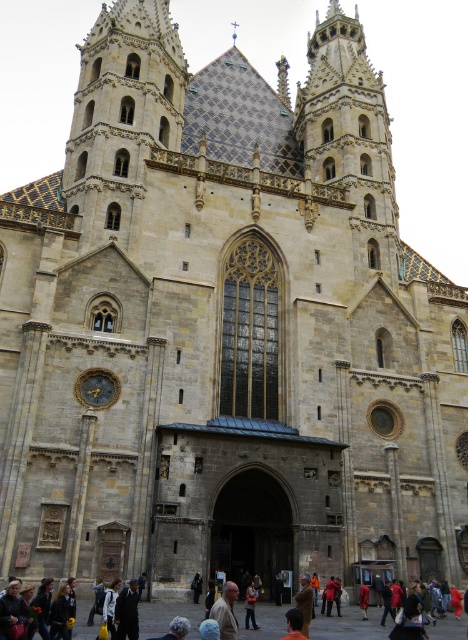
Question: Which object is the closest to the orange fabric shirt at lower center?

Choices:
 (A) light brown leather jacket at lower center
 (B) denim jacket at lower center

Answer: (A)

Question: Does light brown leather jacket at lower center appear on the right side of orange fabric shirt at lower center?

Choices:
 (A) yes
 (B) no

Answer: (B)

Question: Is light brown leather jacket at lower center wider than orange fabric shirt at lower center?

Choices:
 (A) yes
 (B) no

Answer: (A)

Question: Which point is farther to the camera?

Choices:
 (A) (227, 604)
 (B) (251, 616)
 (C) (290, 624)

Answer: (B)

Question: Which point is closer to the camera?

Choices:
 (A) orange fabric shirt at lower center
 (B) denim jacket at lower center

Answer: (A)

Question: Does light brown leather jacket at lower center appear over orange fabric shirt at lower center?

Choices:
 (A) yes
 (B) no

Answer: (A)